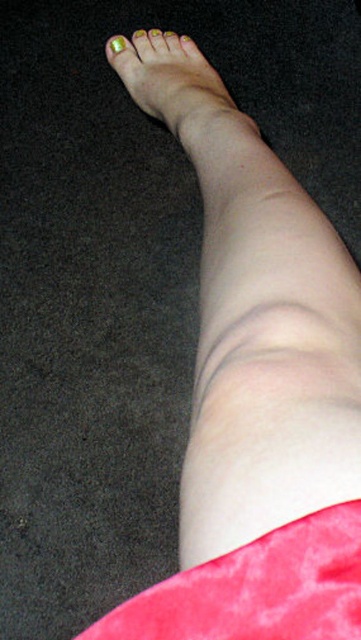
You are a photographer adjusting your camera to focus on the metallic gold nail polish at center. The camera has a grid overlay with coordinates from 0 to 1 on both axes. Where should you position the crosshair to ensure the nail polish is centered in the frame?

Position the crosshair at the coordinates 0.125 on the x axis and 0.474 on the y axis to center the metallic gold nail polish at center.

You are a nail artist preparing to apply polish to a client. You have two options in the image, the metallic gold nail polish at center and the green matte nail polish at upper left. The client wants to know which one is larger. Which one should you choose?

The metallic gold nail polish at center is bigger than the green matte nail polish at upper left, so you should choose the metallic gold nail polish at center.

You are a physical therapist examining a patient. You notice the pink velvety fabric at lower right and the green matte nail polish at upper left in the image. Which object is located below the other?

The pink velvety fabric at lower right is positioned under green matte nail polish at upper left.